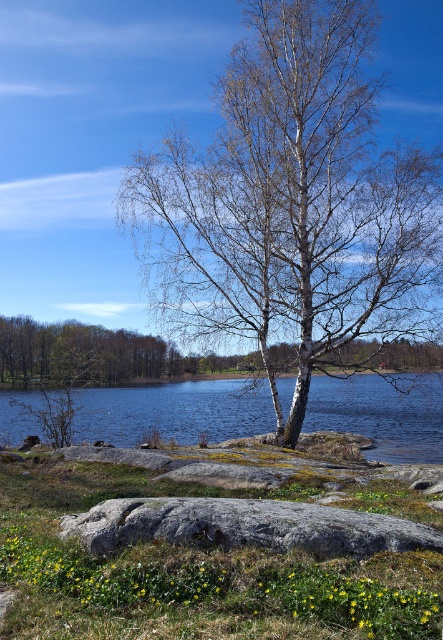
Is clear blue water at center shorter than brown bark tree at center?

Incorrect, clear blue water at center's height does not fall short of brown bark tree at center's.

Find the location of a particular element. Image resolution: width=443 pixels, height=640 pixels. clear blue water at center is located at coordinates (174, 412).

Can you confirm if clear blue water at center is positioned to the right of gray/rough rock at center?

In fact, clear blue water at center is to the left of gray/rough rock at center.

Is clear blue water at center to the left of gray/rough rock at center from the viewer's perspective?

Yes, clear blue water at center is to the left of gray/rough rock at center.

Image resolution: width=443 pixels, height=640 pixels. What do you see at coordinates (174, 412) in the screenshot? I see `clear blue water at center` at bounding box center [174, 412].

The height and width of the screenshot is (640, 443). I want to click on clear blue water at center, so click(174, 412).

Can you confirm if gray/rough rock at center is taller than brown bark tree at center?

No.

Who is taller, gray/rough rock at center or brown bark tree at center?

brown bark tree at center is taller.

Between point (247, 529) and point (159, 358), which one is positioned in front?

Point (247, 529) is in front.

Find the location of a particular element. The width and height of the screenshot is (443, 640). gray/rough rock at center is located at coordinates (244, 525).